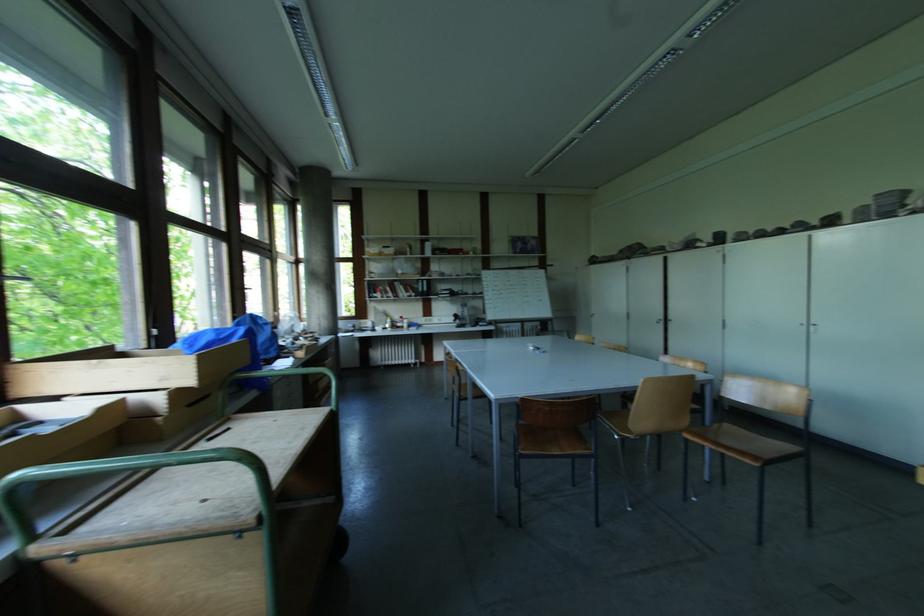
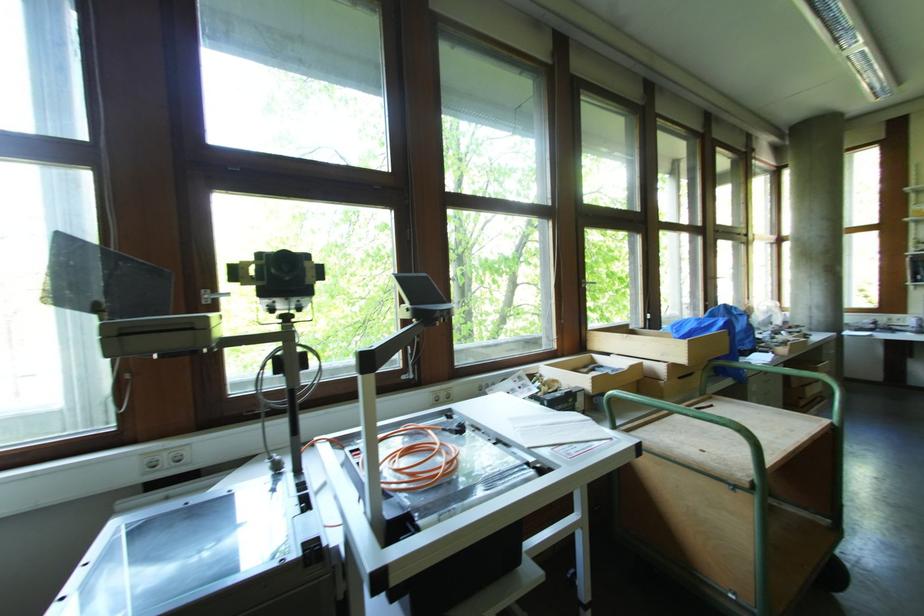
Question: Based on the continuous images, in which direction is the camera rotating? Reply with the corresponding letter.

Choices:
 (A) Left
 (B) Right
 (C) Up
 (D) Down

Answer: (A)